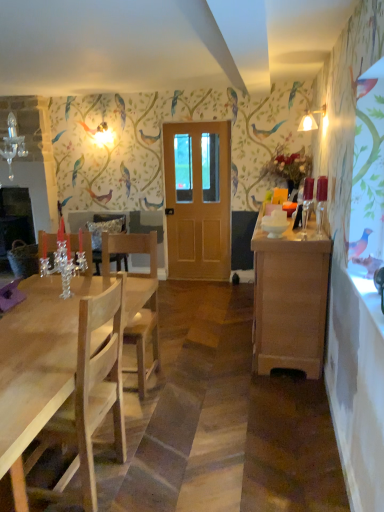
Question: Considering the relative sizes of wooden cabinet at right and matte white lampshade at upper right in the image provided, is wooden cabinet at right taller than matte white lampshade at upper right?

Choices:
 (A) no
 (B) yes

Answer: (B)

Question: Would you say matte white lampshade at upper right is part of wooden cabinet at right's contents?

Choices:
 (A) no
 (B) yes

Answer: (A)

Question: From a real-world perspective, is wooden cabinet at right located higher than matte white lampshade at upper right?

Choices:
 (A) yes
 (B) no

Answer: (B)

Question: Does wooden cabinet at right have a lesser width compared to matte white lampshade at upper right?

Choices:
 (A) no
 (B) yes

Answer: (A)

Question: Considering the relative sizes of wooden cabinet at right and matte white lampshade at upper right in the image provided, is wooden cabinet at right smaller than matte white lampshade at upper right?

Choices:
 (A) no
 (B) yes

Answer: (A)

Question: Considering the positions of point (87, 492) and point (304, 113), is point (87, 492) closer or farther from the camera than point (304, 113)?

Choices:
 (A) closer
 (B) farther

Answer: (A)

Question: From the image's perspective, is light wood chair at left, the 2th chair when ordered from back to front, above or below matte white lampshade at upper right?

Choices:
 (A) above
 (B) below

Answer: (B)

Question: In the image, is light wood chair at left, the 2th chair when ordered from back to front, positioned in front of or behind matte white lampshade at upper right?

Choices:
 (A) front
 (B) behind

Answer: (A)

Question: Is light wood chair at left, the first chair when ordered from front to back, inside the boundaries of matte white lampshade at upper right, or outside?

Choices:
 (A) inside
 (B) outside

Answer: (B)

Question: From the image's perspective, is light wood chair at left, the 2th chair when ordered from back to front, positioned above or below light brown wooden door at center?

Choices:
 (A) above
 (B) below

Answer: (B)

Question: Looking at the image, does light wood chair at left, the first chair when ordered from front to back, seem bigger or smaller compared to light brown wooden door at center?

Choices:
 (A) small
 (B) big

Answer: (B)

Question: Is light wood chair at left, the 2th chair when ordered from back to front, inside or outside of light brown wooden door at center?

Choices:
 (A) outside
 (B) inside

Answer: (A)

Question: From a real-world perspective, is light wood chair at left, the 2th chair when ordered from back to front, physically located above or below light brown wooden door at center?

Choices:
 (A) above
 (B) below

Answer: (B)

Question: Based on their sizes in the image, would you say wooden cabinet at right is bigger or smaller than light wood chair at left, the first chair when ordered from front to back?

Choices:
 (A) big
 (B) small

Answer: (A)

Question: From the image's perspective, relative to light wood chair at left, the first chair when ordered from front to back, is wooden cabinet at right above or below?

Choices:
 (A) below
 (B) above

Answer: (B)